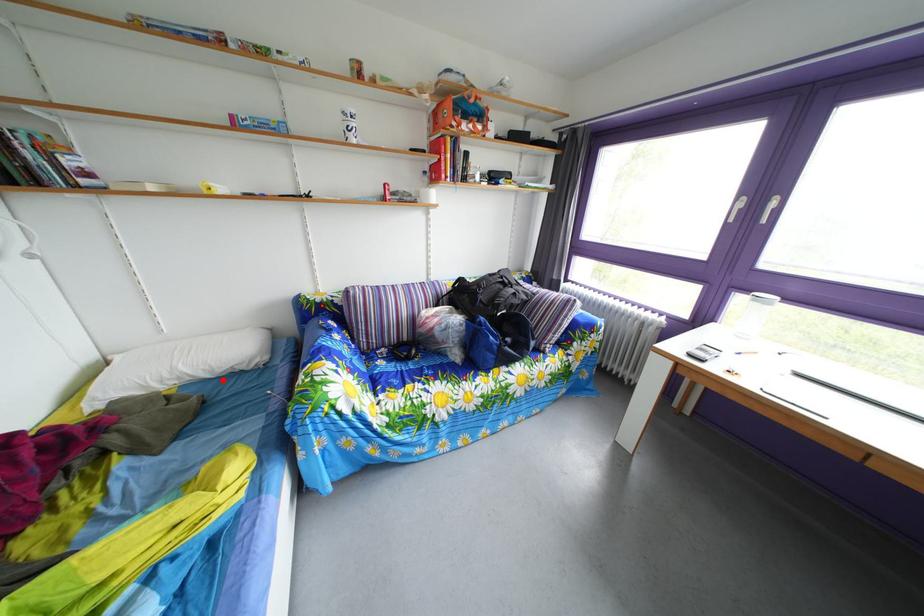
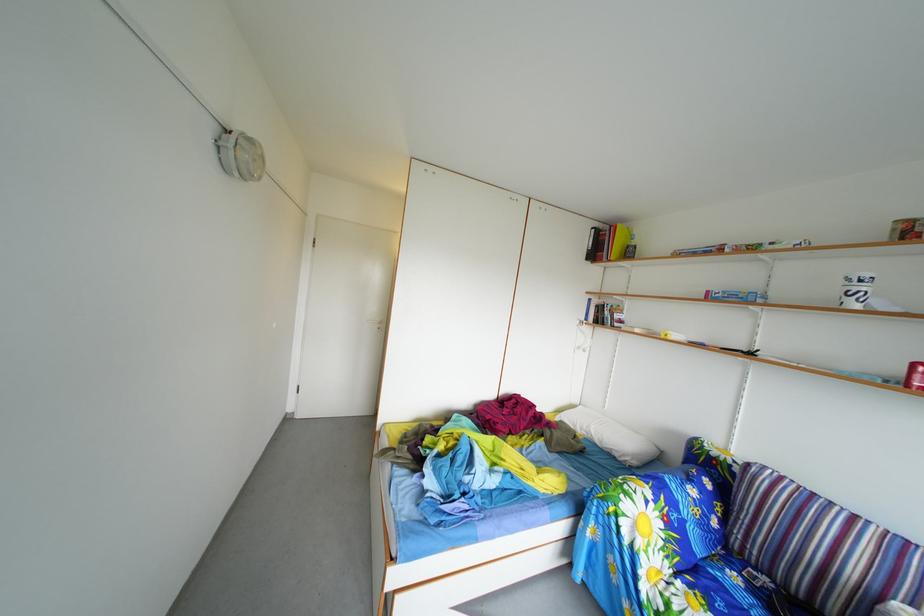
Locate, in the second image, the point that corresponds to the highlighted location in the first image.

(612, 451)